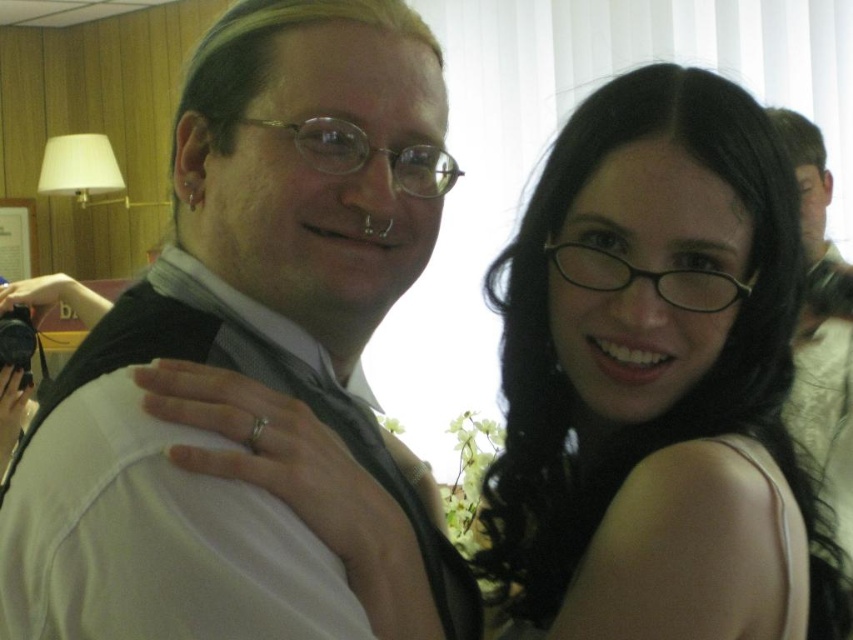
You are a photographer adjusting lighting for a portrait. You need to ensure that the white matte vest at upper left and the black glossy hair at upper center are both well lit. Given their sizes, which object requires a wider light source to cover it adequately?

The black glossy hair at upper center requires a wider light source because it has a greater width than the white matte vest at upper left.

You are a photographer adjusting the camera focus. The camera can only focus on objects within 8 centimeters of each other. You need to focus on both the white matte vest at upper left and the black satin tie at upper center. Can the camera focus on both objects simultaneously?

The distance between the white matte vest at upper left and the black satin tie at upper center is 8.63 centimeters. Since the camera requires objects to be within 8 centimeters of each other for focus, the distance exceeds the limit. Therefore, the camera cannot focus on both objects simultaneously.

You are taking a photo of two people at a social event. There are two points in the image labeled as point (442, 538) and point (637, 554). If you want to focus on the point closer to the camera, which point should you choose?

Point (442, 538) is further to the camera than point (637, 554), so you should choose point (442, 538) to focus on the point closer to the camera.